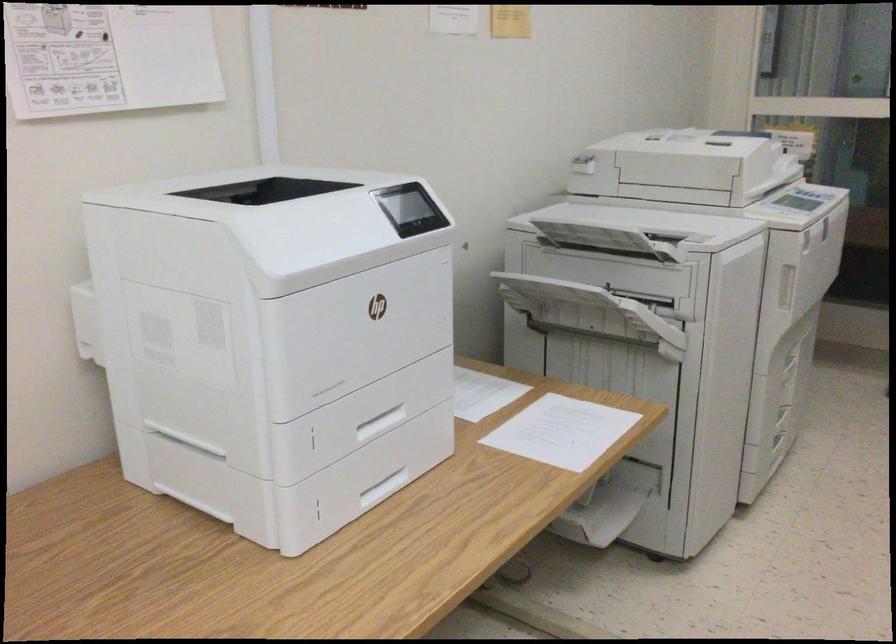
Where would you pull the printer tray handle? Please return your answer as a coordinate pair (x, y).

(601, 301)